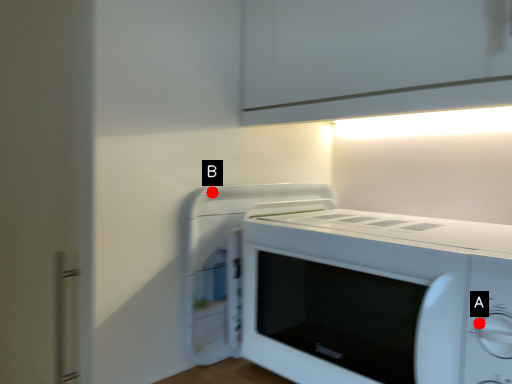
Question: Two points are circled on the image, labeled by A and B beside each circle. Among these points, which one is nearest to the camera?

Choices:
 (A) A is closer
 (B) B is closer

Answer: (A)